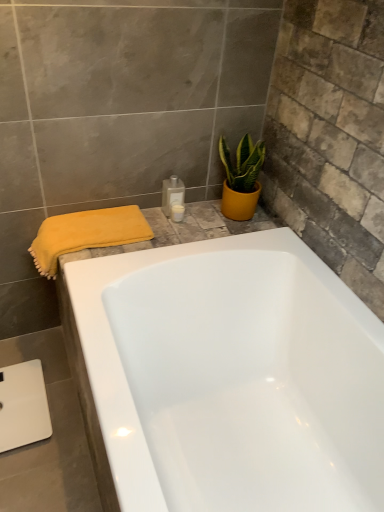
Measure the distance between point (175, 190) and camera.

Point (175, 190) is 4.93 feet from camera.

The image size is (384, 512). I want to click on yellow matte pot at upper right, so click(241, 178).

This screenshot has height=512, width=384. Find the location of `white glossy bottle at upper center, acting as the 2th toiletry starting from the top`. white glossy bottle at upper center, acting as the 2th toiletry starting from the top is located at coordinates (177, 212).

How distant is translucent plastic bottle at upper center, which is counted as the second toiletry, starting from the bottom, from yellow soft towel at left?

A distance of 10.65 inches exists between translucent plastic bottle at upper center, which is counted as the second toiletry, starting from the bottom, and yellow soft towel at left.

Considering the sizes of translucent plastic bottle at upper center, which is counted as the second toiletry, starting from the bottom, and yellow soft towel at left in the image, is translucent plastic bottle at upper center, which is counted as the second toiletry, starting from the bottom, bigger or smaller than yellow soft towel at left?

Considering their sizes, translucent plastic bottle at upper center, which is counted as the second toiletry, starting from the bottom, takes up less space than yellow soft towel at left.

Which object is wider, translucent plastic bottle at upper center, which is counted as the second toiletry, starting from the bottom, or yellow soft towel at left?

yellow soft towel at left.

From the image's perspective, is translucent plastic bottle at upper center, the first toiletry from the top, above or below yellow soft towel at left?

translucent plastic bottle at upper center, the first toiletry from the top, is above yellow soft towel at left.

From the image's perspective, is translucent plastic bottle at upper center, the first toiletry from the top, above yellow matte pot at upper right?

No, from the image's perspective, translucent plastic bottle at upper center, the first toiletry from the top, is not on top of yellow matte pot at upper right.

Based on the photo, would you consider translucent plastic bottle at upper center, which is counted as the second toiletry, starting from the bottom, to be distant from yellow matte pot at upper right?

No, translucent plastic bottle at upper center, which is counted as the second toiletry, starting from the bottom, is not far away from yellow matte pot at upper right.

Considering the relative sizes of translucent plastic bottle at upper center, the first toiletry from the top, and yellow matte pot at upper right in the image provided, is translucent plastic bottle at upper center, the first toiletry from the top, thinner than yellow matte pot at upper right?

Correct, the width of translucent plastic bottle at upper center, the first toiletry from the top, is less than that of yellow matte pot at upper right.

Is translucent plastic bottle at upper center, which is counted as the second toiletry, starting from the bottom, oriented away from yellow matte pot at upper right?

No, yellow matte pot at upper right is not at the back of translucent plastic bottle at upper center, which is counted as the second toiletry, starting from the bottom.

Does white glossy bottle at upper center, acting as the 2th toiletry starting from the top, appear on the right side of yellow matte pot at upper right?

No.

Which is in front, white glossy bottle at upper center, acting as the 2th toiletry starting from the top, or yellow matte pot at upper right?

yellow matte pot at upper right is closer to the camera.

Considering the sizes of white glossy bottle at upper center, acting as the 2th toiletry starting from the top, and yellow matte pot at upper right in the image, is white glossy bottle at upper center, acting as the 2th toiletry starting from the top, wider or thinner than yellow matte pot at upper right?

white glossy bottle at upper center, acting as the 2th toiletry starting from the top, is thinner than yellow matte pot at upper right.

From a real-world perspective, between yellow soft towel at left and yellow matte pot at upper right, who is vertically higher?

yellow matte pot at upper right.

Does yellow soft towel at left have a larger size compared to yellow matte pot at upper right?

Yes, yellow soft towel at left is bigger than yellow matte pot at upper right.

Can you confirm if yellow soft towel at left is positioned to the right of yellow matte pot at upper right?

Incorrect, yellow soft towel at left is not on the right side of yellow matte pot at upper right.

Is yellow soft towel at left not inside yellow matte pot at upper right?

Indeed, yellow soft towel at left is completely outside yellow matte pot at upper right.

From the image's perspective, is yellow matte pot at upper right located above white glossy bottle at upper center, acting as the 2th toiletry starting from the top?

Yes, from the image's perspective, yellow matte pot at upper right is over white glossy bottle at upper center, acting as the 2th toiletry starting from the top.

Is yellow matte pot at upper right taller than white glossy bottle at upper center, acting as the 2th toiletry starting from the top?

Yes.

Considering the sizes of objects yellow matte pot at upper right and white glossy bottle at upper center, acting as the 2th toiletry starting from the top, in the image provided, who is bigger, yellow matte pot at upper right or white glossy bottle at upper center, acting as the 2th toiletry starting from the top,?

With larger size is yellow matte pot at upper right.

Is yellow matte pot at upper right to the left of white glossy bottle at upper center, marked as the 1th toiletry in a bottom-to-top arrangement, from the viewer's perspective?

Incorrect, yellow matte pot at upper right is not on the left side of white glossy bottle at upper center, marked as the 1th toiletry in a bottom-to-top arrangement.

At what (x,y) coordinates should I click in order to perform the action: click on bath towel on the left of white glossy bottle at upper center, acting as the 2th toiletry starting from the top. Please return your answer as a coordinate pair (x, y). This screenshot has height=512, width=384. Looking at the image, I should click on (86, 234).

Is point (181, 210) closer or farther from the camera than point (52, 223)?

Point (181, 210) is farther from the camera than point (52, 223).

Does white glossy bottle at upper center, acting as the 2th toiletry starting from the top, have a smaller size compared to yellow soft towel at left?

Yes, white glossy bottle at upper center, acting as the 2th toiletry starting from the top, is smaller than yellow soft towel at left.

Can you confirm if white glossy bottle at upper center, acting as the 2th toiletry starting from the top, is positioned to the right of yellow soft towel at left?

Yes.

Is yellow soft towel at left outside of white glossy bottle at upper center, acting as the 2th toiletry starting from the top?

Yes, yellow soft towel at left is located beyond the bounds of white glossy bottle at upper center, acting as the 2th toiletry starting from the top.

Does point (83, 237) come farther from viewer compared to point (178, 218)?

No, it is in front of (178, 218).

Considering the sizes of objects yellow soft towel at left and white glossy bottle at upper center, acting as the 2th toiletry starting from the top, in the image provided, who is shorter, yellow soft towel at left or white glossy bottle at upper center, acting as the 2th toiletry starting from the top,?

With less height is white glossy bottle at upper center, acting as the 2th toiletry starting from the top.

Locate an element on the screen. Image resolution: width=384 pixels, height=512 pixels. the 1st toiletry behind the yellow soft towel at left, counting from the anchor's position is located at coordinates (172, 194).

From a real-world perspective, which toiletry is the 1st one underneath the yellow matte pot at upper right? Please provide its 2D coordinates.

[(172, 194)]

In the scene shown: Which object lies further to the anchor point yellow matte pot at upper right, yellow soft towel at left or translucent plastic bottle at upper center, the first toiletry from the top?

Based on the image, yellow soft towel at left appears to be further to yellow matte pot at upper right.

Looking at the image, which one is located further to translucent plastic bottle at upper center, which is counted as the second toiletry, starting from the bottom, yellow matte pot at upper right or yellow soft towel at left?

The object further to translucent plastic bottle at upper center, which is counted as the second toiletry, starting from the bottom, is yellow soft towel at left.

Considering their positions, is yellow soft towel at left positioned further to translucent plastic bottle at upper center, the first toiletry from the top, than white glossy bottle at upper center, marked as the 1th toiletry in a bottom-to-top arrangement?

yellow soft towel at left is positioned further to the anchor translucent plastic bottle at upper center, the first toiletry from the top.

Looking at the image, which one is located further to yellow soft towel at left, yellow matte pot at upper right or translucent plastic bottle at upper center, which is counted as the second toiletry, starting from the bottom?

The object further to yellow soft towel at left is yellow matte pot at upper right.

When comparing their distances from translucent plastic bottle at upper center, which is counted as the second toiletry, starting from the bottom, does white glossy bottle at upper center, acting as the 2th toiletry starting from the top, or yellow soft towel at left seem closer?

white glossy bottle at upper center, acting as the 2th toiletry starting from the top, is positioned closer to the anchor translucent plastic bottle at upper center, which is counted as the second toiletry, starting from the bottom.

Looking at the image, which one is located further to translucent plastic bottle at upper center, the first toiletry from the top, yellow soft towel at left or yellow matte pot at upper right?

yellow soft towel at left is positioned further to the anchor translucent plastic bottle at upper center, the first toiletry from the top.

Looking at the image, which one is located closer to translucent plastic bottle at upper center, the first toiletry from the top, white glossy bottle at upper center, marked as the 1th toiletry in a bottom-to-top arrangement, or yellow matte pot at upper right?

Based on the image, white glossy bottle at upper center, marked as the 1th toiletry in a bottom-to-top arrangement, appears to be nearer to translucent plastic bottle at upper center, the first toiletry from the top.

Which object lies nearer to the anchor point white glossy bottle at upper center, marked as the 1th toiletry in a bottom-to-top arrangement, translucent plastic bottle at upper center, the first toiletry from the top, or yellow soft towel at left?

The object closer to white glossy bottle at upper center, marked as the 1th toiletry in a bottom-to-top arrangement, is translucent plastic bottle at upper center, the first toiletry from the top.

Identify the location of toiletry between yellow soft towel at left and white glossy bottle at upper center, acting as the 2th toiletry starting from the top. The width and height of the screenshot is (384, 512). (172, 194).

Find the location of a particular element. The width and height of the screenshot is (384, 512). toiletry situated between translucent plastic bottle at upper center, the first toiletry from the top, and yellow matte pot at upper right from left to right is located at coordinates (177, 212).